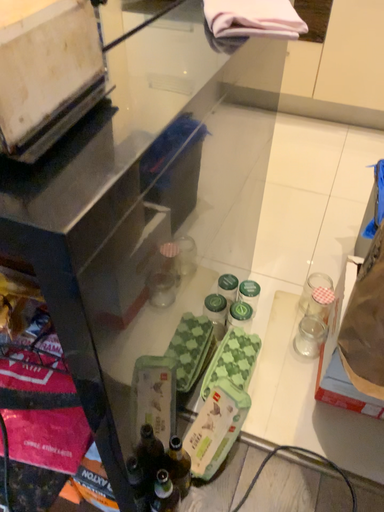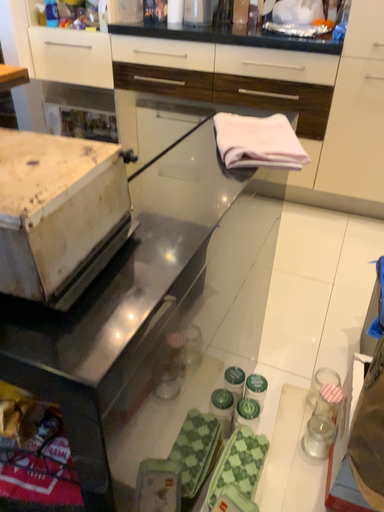
Question: Which way did the camera rotate in the video?

Choices:
 (A) rotated upward
 (B) rotated downward

Answer: (A)